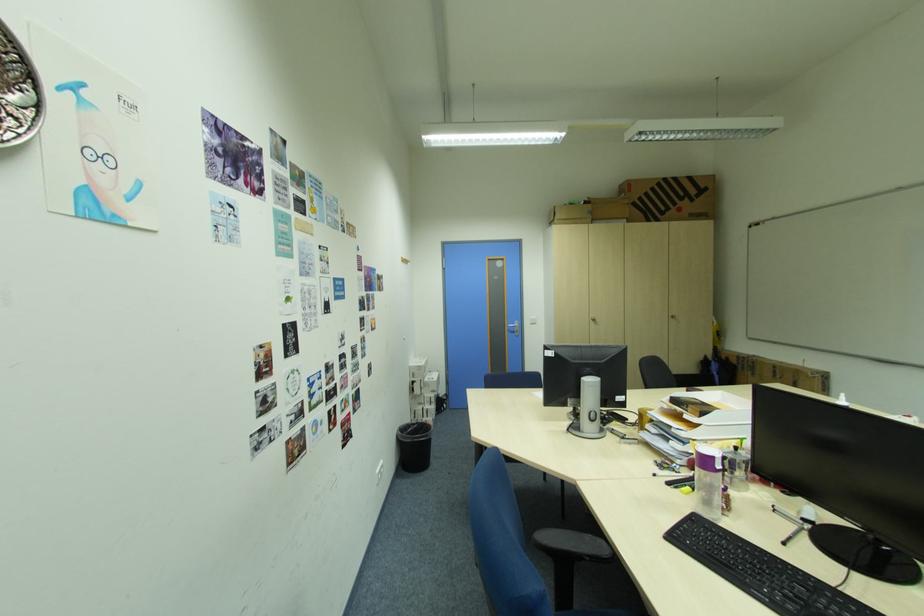
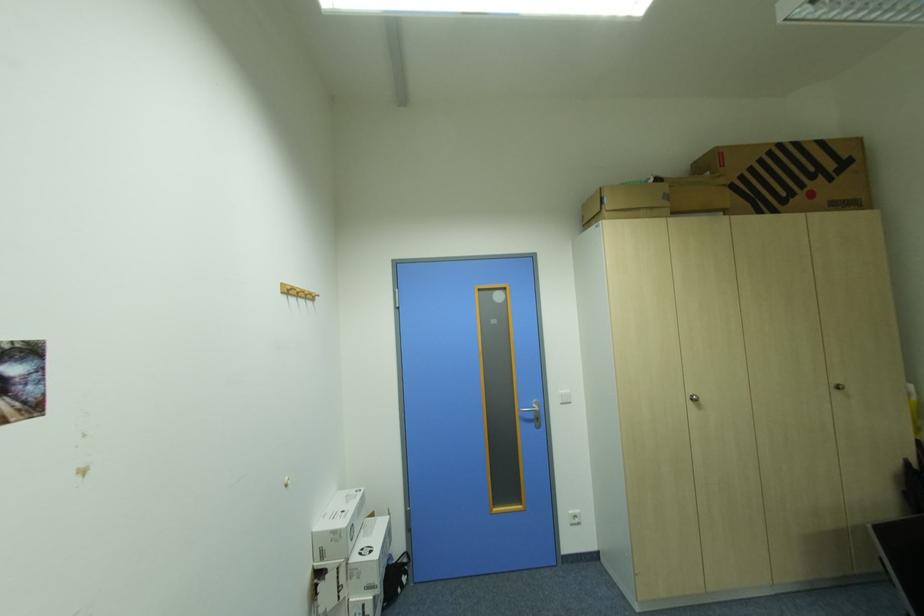
Find the pixel in the second image that matches point 665,185 in the first image.

(777, 153)